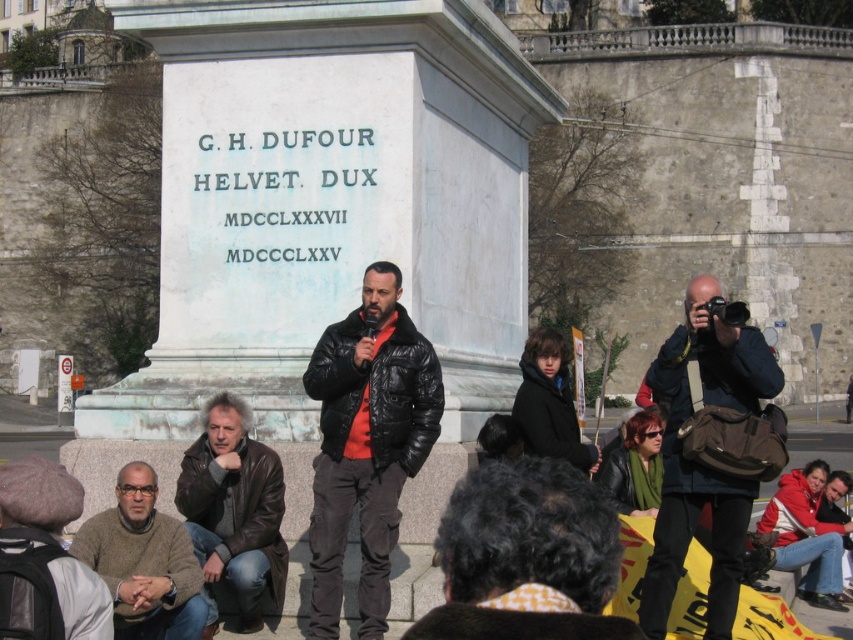
Question: Is leather jacket at lower left to the left of brown sweater at lower left from the viewer's perspective?

Choices:
 (A) yes
 (B) no

Answer: (B)

Question: Is dark blue jacket at right positioned at the back of leather jacket at lower left?

Choices:
 (A) no
 (B) yes

Answer: (A)

Question: Which object is positioned closest to the brown sweater at lower left?

Choices:
 (A) red jacket at lower right
 (B) black matte jacket at center
 (C) dark blue jacket at right
 (D) leather jacket at lower left

Answer: (D)

Question: Is leather jacket at lower left smaller than red jacket at lower right?

Choices:
 (A) yes
 (B) no

Answer: (B)

Question: Which of the following is the closest to the observer?

Choices:
 (A) brown sweater at lower left
 (B) red jacket at lower right
 (C) black matte jacket at center
 (D) dark blue jacket at right

Answer: (A)

Question: Which object is the farthest from the black matte jacket at center?

Choices:
 (A) leather jacket at lower left
 (B) brown sweater at lower left
 (C) red jacket at lower right
 (D) dark blue jacket at right

Answer: (C)